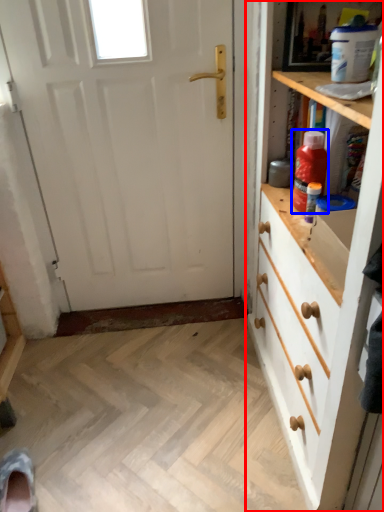
Question: Which point is further to the camera, chest of drawers (highlighted by a red box) or bottle (highlighted by a blue box)?

Choices:
 (A) chest of drawers
 (B) bottle

Answer: (B)